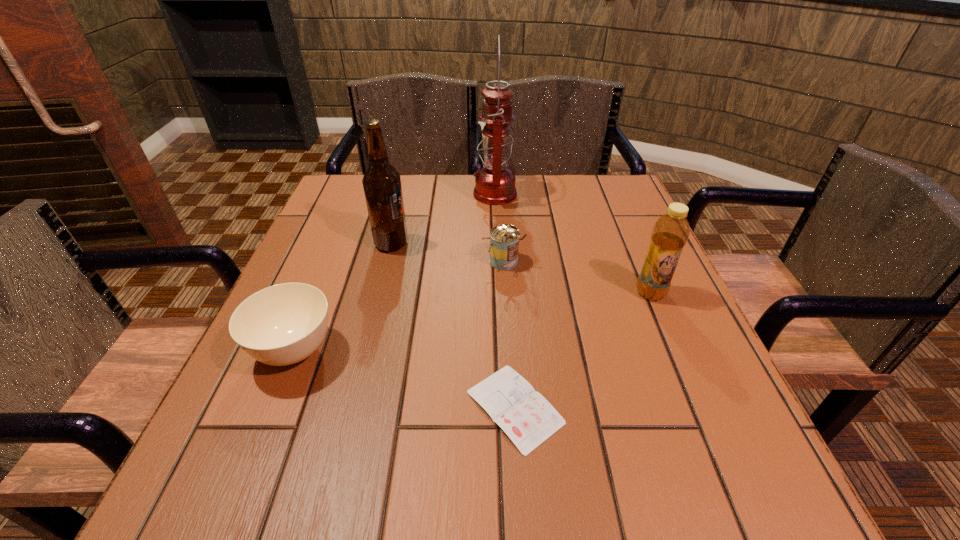
Identify the location of free spot at the far edge of the desktop. (558, 213).

Where is `blank area at the near edge`? Image resolution: width=960 pixels, height=540 pixels. blank area at the near edge is located at coordinates (325, 452).

Where is `vacant region at the left edge`? This screenshot has width=960, height=540. vacant region at the left edge is located at coordinates (258, 367).

At what (x,y) coordinates should I click in order to perform the action: click on vacant region at the right edge of the desktop. Please return your answer as a coordinate pair (x, y). The width and height of the screenshot is (960, 540). Looking at the image, I should click on (588, 232).

The height and width of the screenshot is (540, 960). I want to click on free space at the far left corner of the desktop, so click(x=348, y=211).

This screenshot has height=540, width=960. Find the location of `free space at the near left corner`. free space at the near left corner is located at coordinates (268, 459).

This screenshot has width=960, height=540. Identify the location of empty space between the beer bottle and the second shortest object. (343, 298).

Where is `vacant area that lies between the bottle and the shortest object`? The height and width of the screenshot is (540, 960). vacant area that lies between the bottle and the shortest object is located at coordinates (583, 350).

Find the location of `vacant area between the third shortest object and the diary`. vacant area between the third shortest object and the diary is located at coordinates (509, 334).

Find the location of `free space between the fourth shortest object and the third shortest object`. free space between the fourth shortest object and the third shortest object is located at coordinates (577, 277).